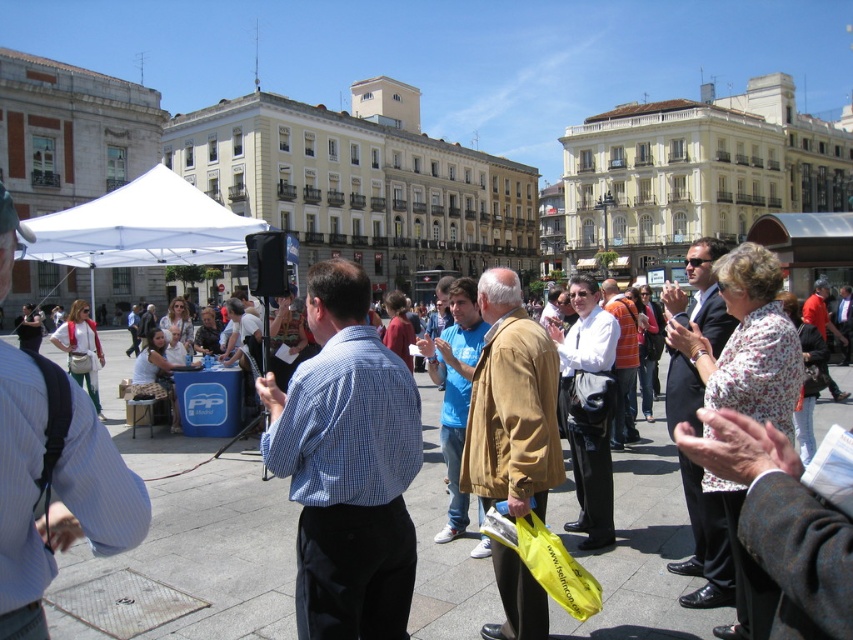
Does blue checkered shirt at center have a larger size compared to white fabric canopy at upper left?

Incorrect, blue checkered shirt at center is not larger than white fabric canopy at upper left.

From the picture: Does blue checkered shirt at center appear on the left side of white fabric canopy at upper left?

In fact, blue checkered shirt at center is to the right of white fabric canopy at upper left.

Describe the element at coordinates (347, 465) in the screenshot. I see `blue checkered shirt at center` at that location.

Locate an element on the screen. The image size is (853, 640). blue checkered shirt at center is located at coordinates pos(347,465).